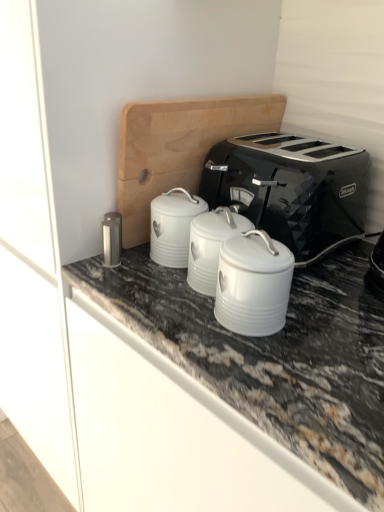
Question: Is the position of satin silver canister at center-left, which ranks as the first appliance in left-to-right order, less distant than that of white ceramic canister at center, the third appliance in the left-to-right sequence?

Choices:
 (A) yes
 (B) no

Answer: (B)

Question: Are satin silver canister at center-left, which ranks as the first appliance in left-to-right order, and white ceramic canister at center, the third appliance in the left-to-right sequence, located far from each other?

Choices:
 (A) yes
 (B) no

Answer: (B)

Question: Does satin silver canister at center-left, marked as the third appliance in a right-to-left arrangement, have a smaller size compared to white ceramic canister at center, the first appliance viewed from the right?

Choices:
 (A) yes
 (B) no

Answer: (A)

Question: From the image's perspective, is satin silver canister at center-left, which ranks as the first appliance in left-to-right order, under white ceramic canister at center, the first appliance viewed from the right?

Choices:
 (A) no
 (B) yes

Answer: (A)

Question: Is satin silver canister at center-left, marked as the third appliance in a right-to-left arrangement, beside white ceramic canister at center, the third appliance in the left-to-right sequence?

Choices:
 (A) yes
 (B) no

Answer: (B)

Question: From a real-world perspective, is satin silver canister at center-left, marked as the third appliance in a right-to-left arrangement, positioned under white ceramic canister at center, the third appliance in the left-to-right sequence, based on gravity?

Choices:
 (A) no
 (B) yes

Answer: (B)

Question: Is white enameled canister at center, which appears as the 2th appliance when viewed from the left, beside satin silver canister at center-left, which ranks as the first appliance in left-to-right order?

Choices:
 (A) no
 (B) yes

Answer: (A)

Question: Does white enameled canister at center, the 2th appliance when ordered from right to left, lie in front of satin silver canister at center-left, marked as the third appliance in a right-to-left arrangement?

Choices:
 (A) no
 (B) yes

Answer: (B)

Question: Does white enameled canister at center, the 2th appliance when ordered from right to left, have a larger size compared to satin silver canister at center-left, which ranks as the first appliance in left-to-right order?

Choices:
 (A) no
 (B) yes

Answer: (B)

Question: Considering the relative positions of white enameled canister at center, which appears as the 2th appliance when viewed from the left, and satin silver canister at center-left, which ranks as the first appliance in left-to-right order, in the image provided, is white enameled canister at center, which appears as the 2th appliance when viewed from the left, to the left of satin silver canister at center-left, which ranks as the first appliance in left-to-right order, from the viewer's perspective?

Choices:
 (A) no
 (B) yes

Answer: (A)

Question: Does white enameled canister at center, the 2th appliance when ordered from right to left, have a lesser width compared to satin silver canister at center-left, which ranks as the first appliance in left-to-right order?

Choices:
 (A) yes
 (B) no

Answer: (B)

Question: Is satin silver canister at center-left, which ranks as the first appliance in left-to-right order, surrounded by white enameled canister at center, which appears as the 2th appliance when viewed from the left?

Choices:
 (A) no
 (B) yes

Answer: (A)

Question: Can you see black metallic toaster at center touching white ceramic canister at center, the first appliance viewed from the right?

Choices:
 (A) no
 (B) yes

Answer: (A)